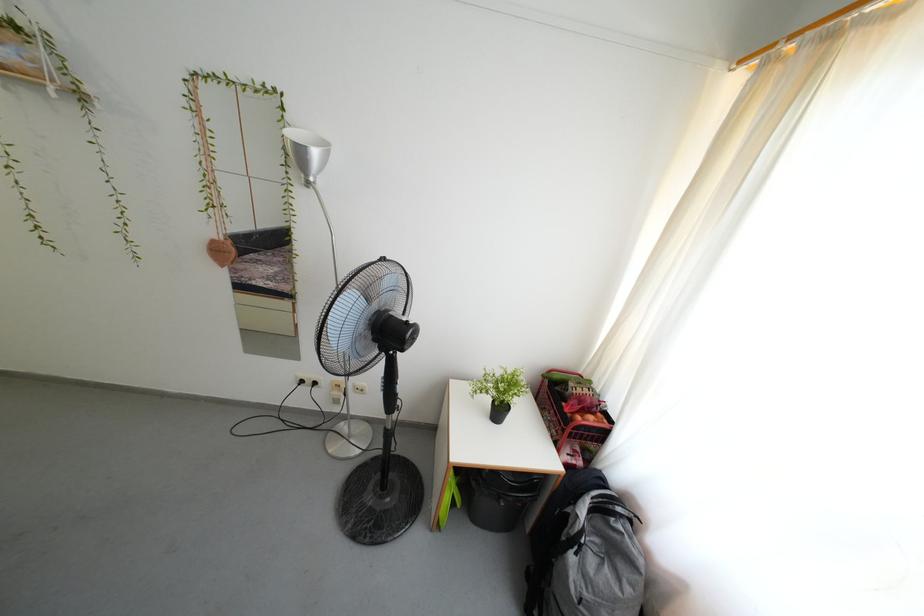
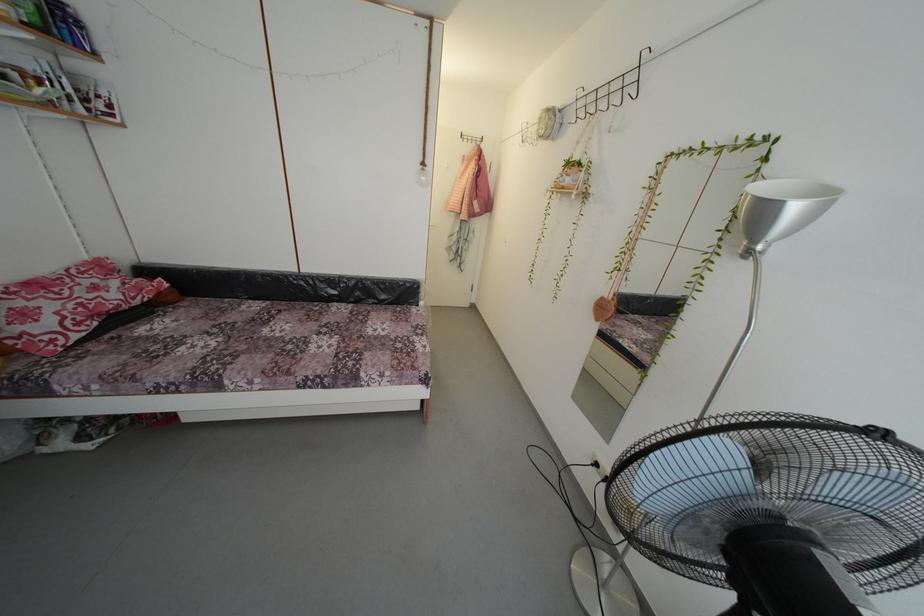
The point at (307, 387) is marked in the first image. Where is the corresponding point in the second image?

(602, 469)